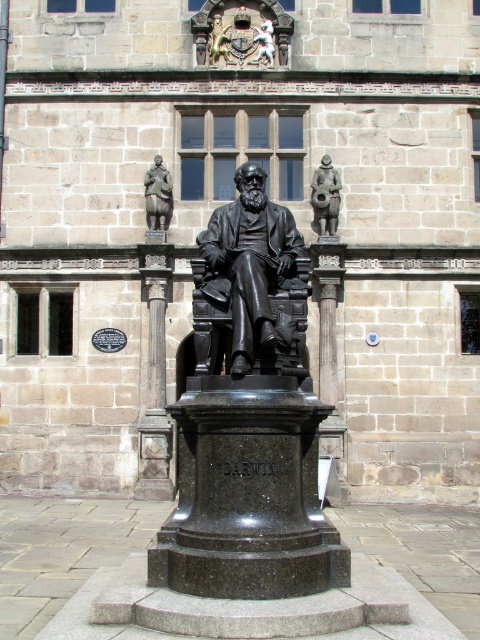
You are a tour guide leading a group near the bronze cannon at center and the bronze statue at upper center. You want to tell the visitors how far apart these two landmarks are. What should you say?

The bronze cannon at center is 19.34 feet away from the bronze statue at upper center.

You are a city planner assessing the space between the black polished stone pillar at center and the bronze statue at upper center. If you want to place a small bench here, which object should the bench be placed closer to to ensure it doesn

The black polished stone pillar at center is wider than the bronze statue at upper center. To place the bench closer to the wider object, position it near the black polished stone pillar at center.